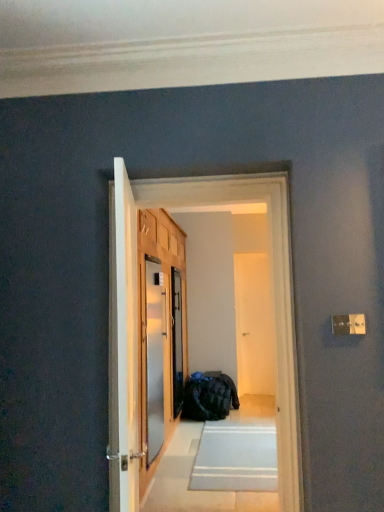
Question: In the image, is white glossy door at center, which ranks as the 3th screen door in left-to-right order, positioned in front of or behind white glossy door at center?

Choices:
 (A) front
 (B) behind

Answer: (B)

Question: Is white glossy door at center, acting as the 1th screen door starting from the right, to the left or to the right of white glossy door at center in the image?

Choices:
 (A) right
 (B) left

Answer: (A)

Question: Considering the real-world distances, which object is farthest from the clear glass screen door at center, the second screen door when ordered from front to back?

Choices:
 (A) white glossy door at center, positioned as the 3th screen door in front-to-back order
 (B) metallic refrigerator at center
 (C) satin silver screen door at center, the third screen door positioned from the back
 (D) white glossy door at center

Answer: (B)

Question: Based on their relative distances, which object is farther from the satin silver screen door at center, the third screen door positioned from the back?

Choices:
 (A) white glossy door at center
 (B) clear glass screen door at center, placed as the second screen door when sorted from right to left
 (C) metallic refrigerator at center
 (D) white glossy door at center, acting as the 1th screen door starting from the right

Answer: (D)